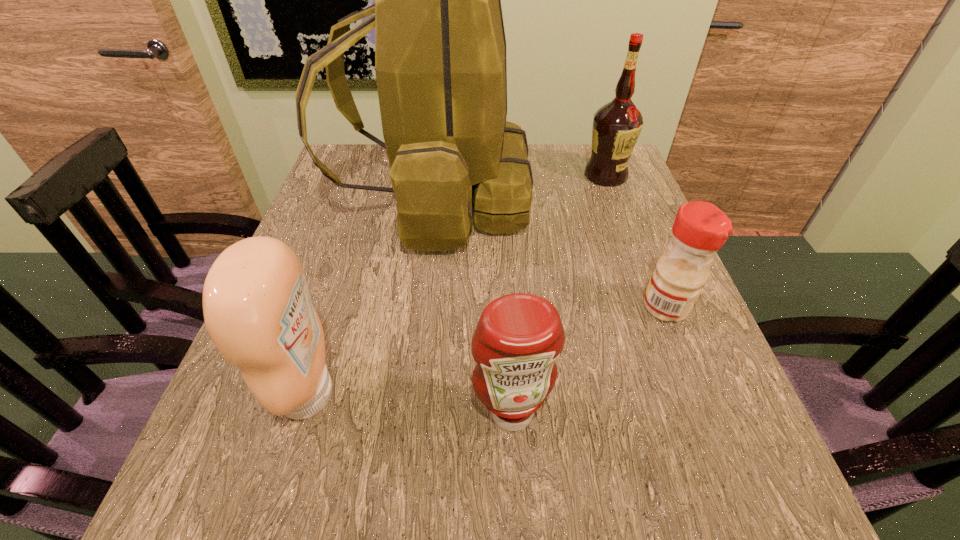
The height and width of the screenshot is (540, 960). What are the coordinates of `vacant space that satisfies the following two spatial constraints: 1. on the back side of the third farthest object; 2. on the front-facing side of the backpack` in the screenshot? It's located at (x=623, y=198).

This screenshot has width=960, height=540. What are the coordinates of `free location that satisfies the following two spatial constraints: 1. on the label of the fourth shortest object; 2. on the label of the third tallest object` in the screenshot? It's located at [686, 394].

Find the location of a particular element. vacant space that satisfies the following two spatial constraints: 1. on the front-facing side of the second condiment from left to right; 2. on the left side of the tallest object is located at coordinates (407, 412).

Locate an element on the screen. free space that satisfies the following two spatial constraints: 1. on the label of the fourth shortest object; 2. on the left side of the third nearest object is located at coordinates (655, 307).

Find the location of a particular element. The image size is (960, 540). vacant position in the image that satisfies the following two spatial constraints: 1. on the label of the third tallest object; 2. on the left side of the second condiment from left to right is located at coordinates (303, 412).